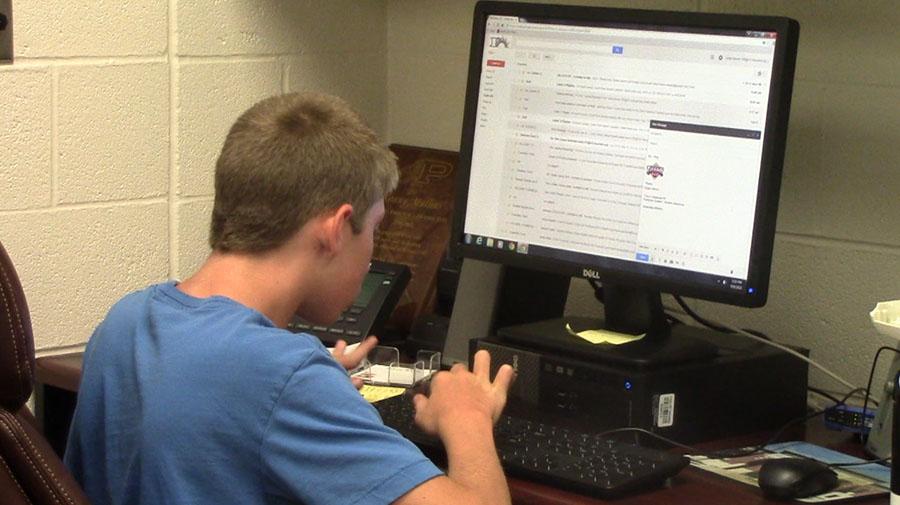
At what (x,y) coordinates should I click in order to perform the action: click on keyboard. Please return your answer as a coordinate pair (x, y). This screenshot has width=900, height=505. Looking at the image, I should click on (610, 469).